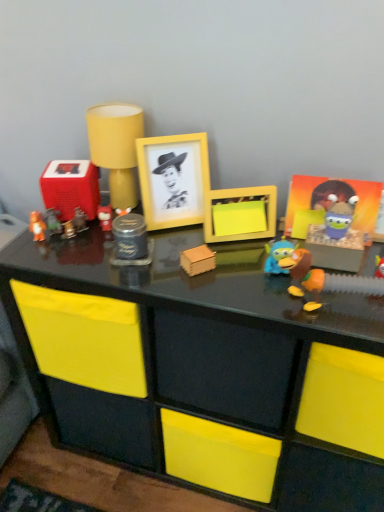
You are a GUI agent. You are given a task and a screenshot of the screen. Output one action in this format:
    pyautogui.click(x=<x>, y=<y>)
    Task: Click on the vacant area that is situated to the right of wooden block at center, positioned as the ninth toy in left-to-right order
    
    Given the screenshot: What is the action you would take?
    pyautogui.click(x=255, y=286)